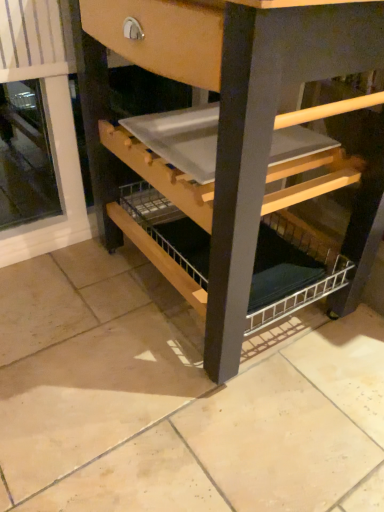
Locate an element on the screen. Image resolution: width=384 pixels, height=512 pixels. wooden tray at center is located at coordinates (244, 146).

The image size is (384, 512). What do you see at coordinates (244, 146) in the screenshot?
I see `wooden tray at center` at bounding box center [244, 146].

What is the approximate height of wooden tray at center?

It is 31.31 inches.

At what (x,y) coordinates should I click in order to perform the action: click on wooden tray at center. Please return your answer as a coordinate pair (x, y). The image size is (384, 512). Looking at the image, I should click on (244, 146).